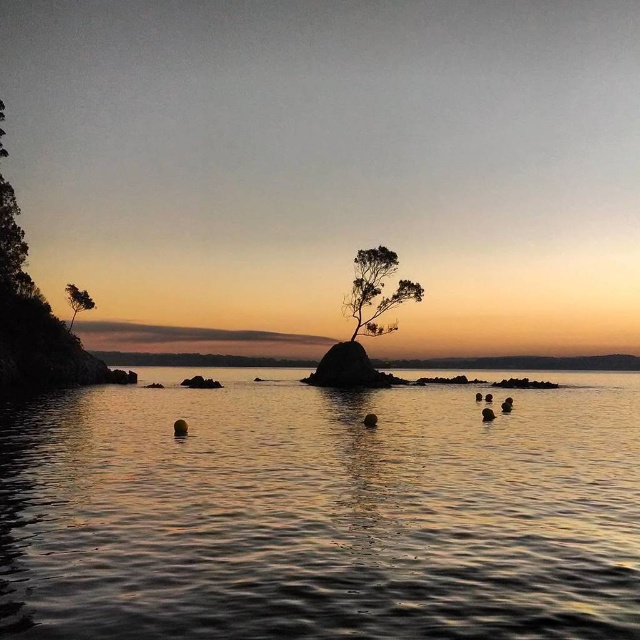
Between glistening water at center and green matte tree at left, which one appears on the right side from the viewer's perspective?

From the viewer's perspective, glistening water at center appears more on the right side.

Is glistening water at center bigger than green matte tree at left?

Yes, glistening water at center is bigger than green matte tree at left.

This screenshot has height=640, width=640. Find the location of `glistening water at center`. glistening water at center is located at coordinates (321, 513).

Is glistening water at center smaller than silhouette wood tree at center?

No, glistening water at center is not smaller than silhouette wood tree at center.

What are the coordinates of `glistening water at center` in the screenshot? It's located at (321, 513).

Is silhouette wood tree at center closer to the viewer compared to green matte tree at left?

Yes, it is in front of green matte tree at left.

Is point (387, 252) more distant than point (84, 292)?

That is False.

Identify the location of silhouette wood tree at center. The height and width of the screenshot is (640, 640). (376, 291).

At what (x,y) coordinates should I click in order to perform the action: click on silhouette wood tree at center. Please return your answer as a coordinate pair (x, y). Looking at the image, I should click on (376, 291).